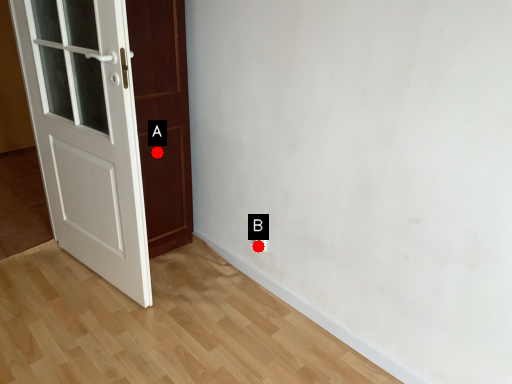
Question: Two points are circled on the image, labeled by A and B beside each circle. Among these points, which one is farthest from the camera?

Choices:
 (A) A is further
 (B) B is further

Answer: (B)